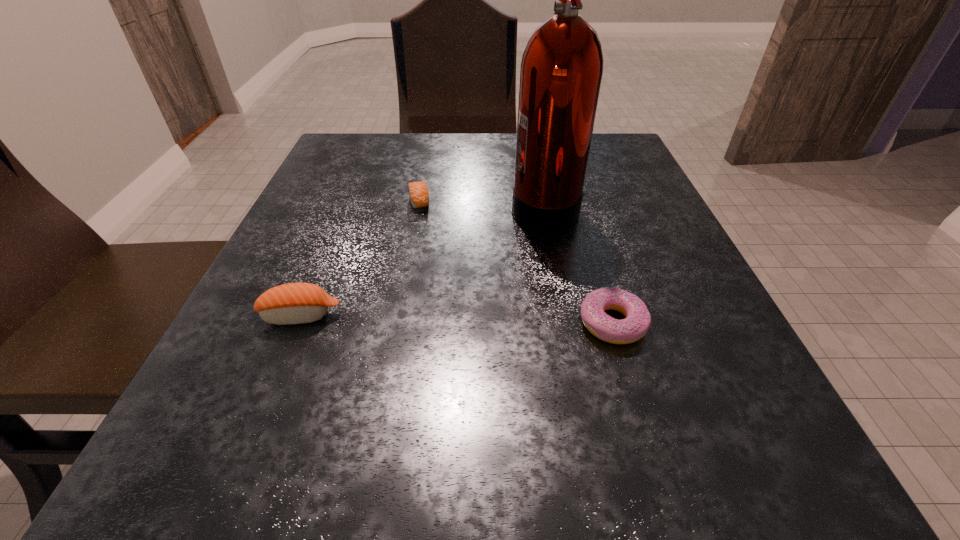
Find the location of a particular element. free space at the right edge of the desktop is located at coordinates (634, 242).

The width and height of the screenshot is (960, 540). What are the coordinates of `free space at the far left corner of the desktop` in the screenshot? It's located at (382, 137).

This screenshot has height=540, width=960. In order to click on vacant position at the near right corner of the desktop in this screenshot , I will do `click(796, 469)`.

The image size is (960, 540). Find the location of `free space between the doughnut and the taller sushi`. free space between the doughnut and the taller sushi is located at coordinates 456,319.

Where is `unoccupied area between the second object from left to right and the fire extinguisher`? This screenshot has width=960, height=540. unoccupied area between the second object from left to right and the fire extinguisher is located at coordinates (482, 202).

The image size is (960, 540). What are the coordinates of `vacant area that lies between the tallest object and the third object from right to left` in the screenshot? It's located at (482, 202).

Identify the location of vacant area between the doughnut and the fire extinguisher. (578, 264).

You are a GUI agent. You are given a task and a screenshot of the screen. Output one action in this format:
    pyautogui.click(x=<x>, y=<y>)
    Task: Click on the free space between the fire extinguisher and the right sushi
    
    Given the screenshot: What is the action you would take?
    click(x=482, y=202)

The image size is (960, 540). Find the location of `vacant region between the third shortest object and the fire extinguisher`. vacant region between the third shortest object and the fire extinguisher is located at coordinates (422, 260).

Locate an element on the screen. vacant area between the taller sushi and the third object from right to left is located at coordinates (360, 258).